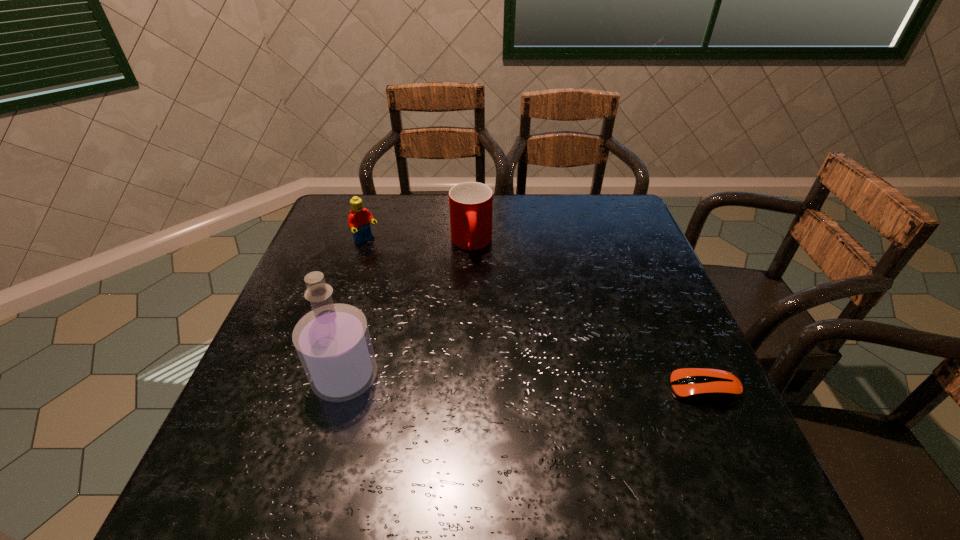
Find the location of `free space on the desktop that is between the perfume and the shortest object and is positioned on the side of the third object from left to right with the handle`. free space on the desktop that is between the perfume and the shortest object and is positioned on the side of the third object from left to right with the handle is located at coordinates (480, 382).

Identify the location of vacant spot on the desktop that is between the perfume and the rightmost object and is positioned on the face of the Lego. The image size is (960, 540). (534, 384).